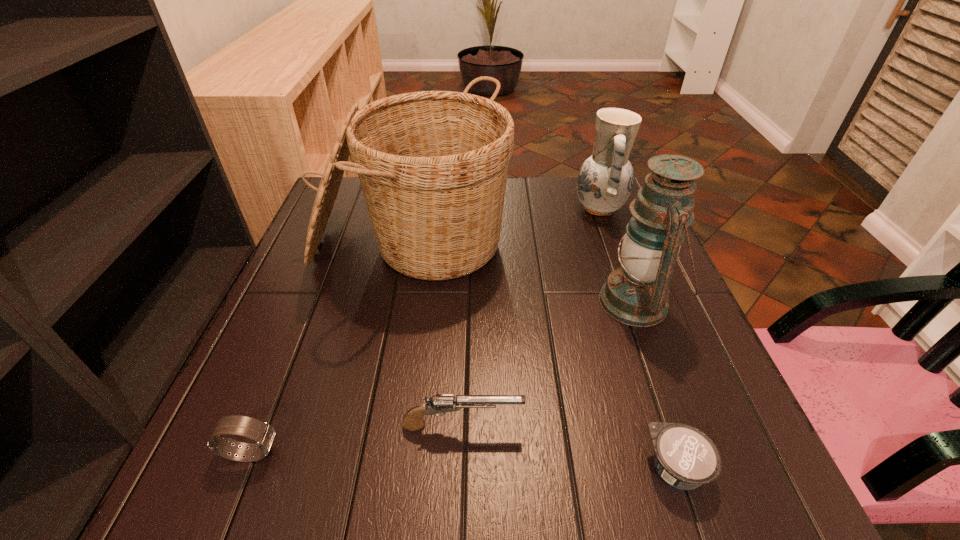
In the image, there is a desktop. Where is `vacant space at the near left corner`? This screenshot has width=960, height=540. vacant space at the near left corner is located at coordinates (250, 493).

Image resolution: width=960 pixels, height=540 pixels. Identify the location of free spot between the oil lamp and the gun. (550, 364).

This screenshot has width=960, height=540. Find the location of `unoccupied position between the oil lamp and the pottery`. unoccupied position between the oil lamp and the pottery is located at coordinates (618, 255).

You are a GUI agent. You are given a task and a screenshot of the screen. Output one action in this format:
    pyautogui.click(x=<x>, y=<y>)
    Task: Click on the unoccupied area between the basket and the gun
    Image resolution: width=960 pixels, height=540 pixels.
    Given the screenshot: What is the action you would take?
    (x=438, y=336)

Identify the location of free space that is in between the shortest object and the basket. (544, 357).

Where is `free space that is in between the basket and the watch`? The image size is (960, 540). free space that is in between the basket and the watch is located at coordinates click(x=332, y=349).

The height and width of the screenshot is (540, 960). Identify the location of free point between the oil lamp and the fourth shortest object. pos(618,255).

Find the location of `free spot between the basket and the gun`. free spot between the basket and the gun is located at coordinates (438, 336).

I want to click on free spot between the watch and the fourth farthest object, so click(357, 439).

Where is `vacant space that is in between the oil lamp and the shortest object`? vacant space that is in between the oil lamp and the shortest object is located at coordinates (657, 385).